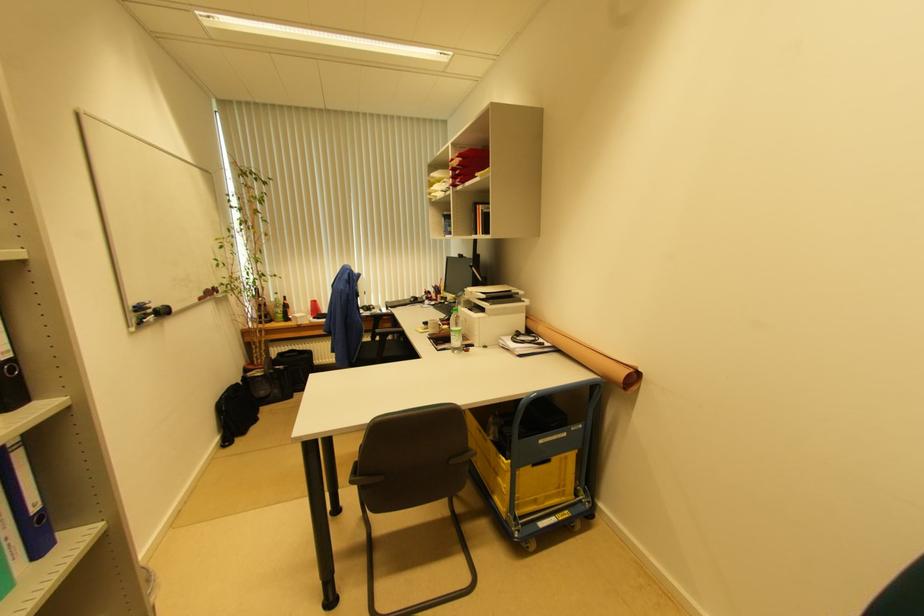
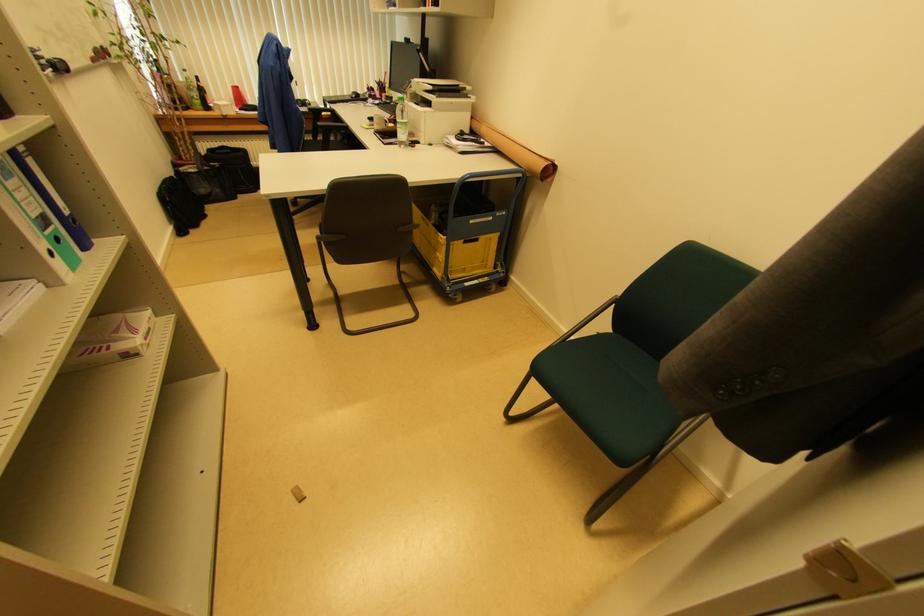
Where in the second image is the point corresponding to (284,313) from the first image?

(200, 98)